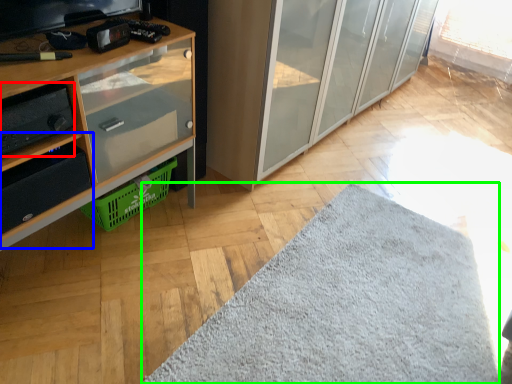
Question: Which object is the closest to the stereo (highlighted by a red box)? Choose among these: shelf (highlighted by a blue box) or mat (highlighted by a green box).

Choices:
 (A) shelf
 (B) mat

Answer: (A)